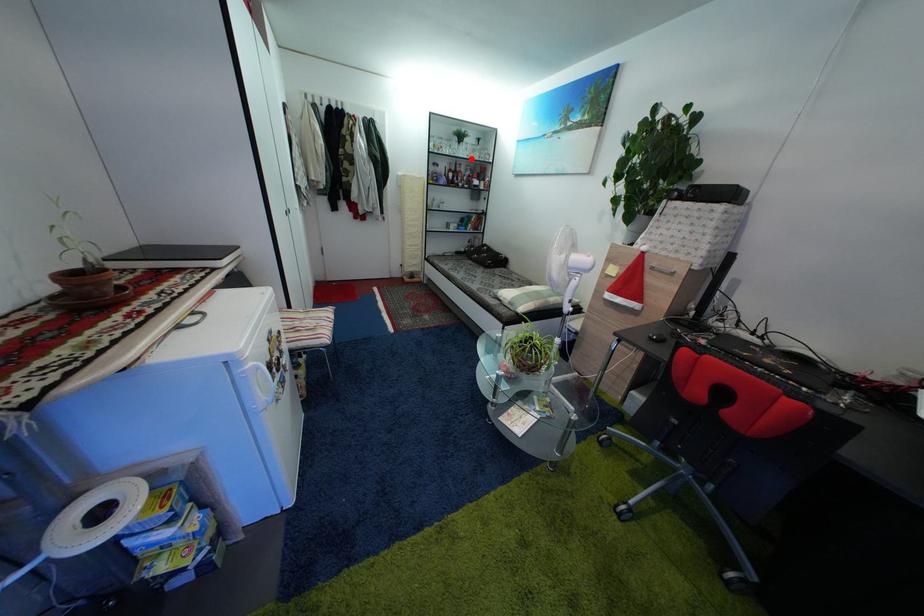
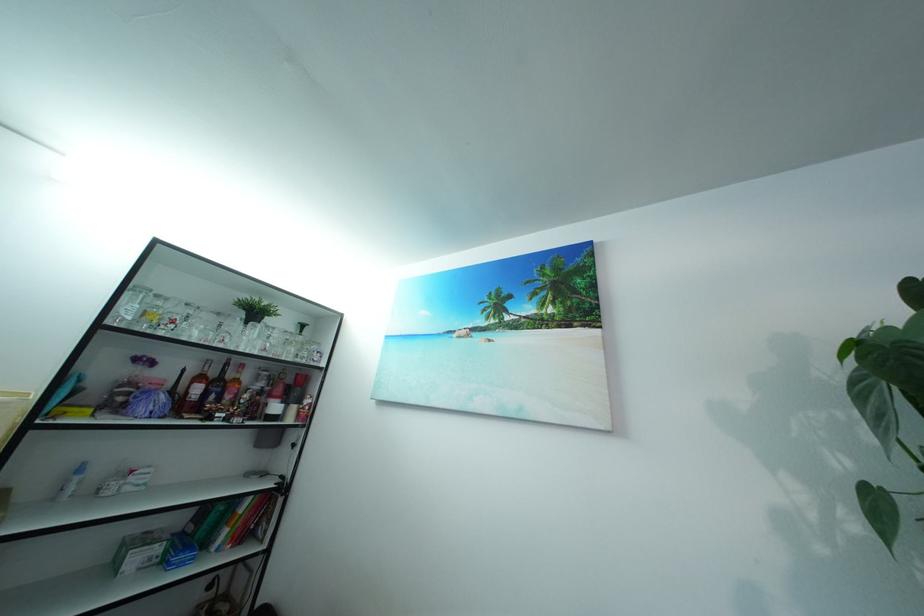
Question: I am providing you with two images of the same scene from different viewpoints. In image1, a red point is highlighted. Considering the same 3D point in image2, which of the following is correct?

Choices:
 (A) It is closer
 (B) It is farther

Answer: (B)